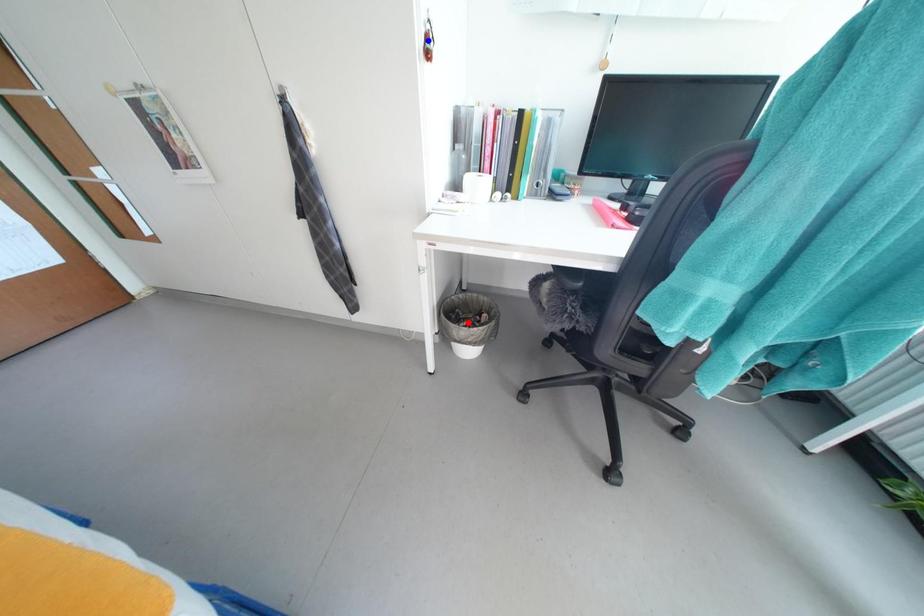
Question: In the image, two points are highlighted. Which point is nearer to the camera? Reply with the corresponding letter.

Choices:
 (A) blue point
 (B) red point

Answer: (A)